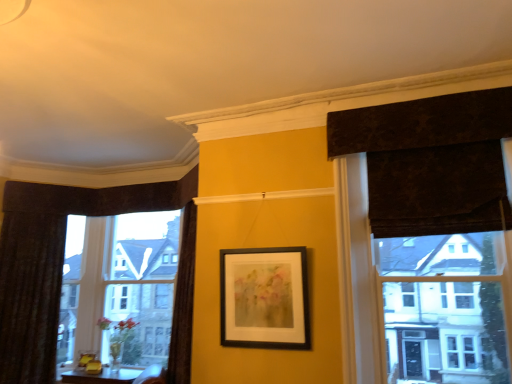
Question: Is velvet dark brown curtain at left, which appears as the first curtain when viewed from the left, shorter than black matte picture frame at center?

Choices:
 (A) yes
 (B) no

Answer: (B)

Question: Considering the relative positions of velvet dark brown curtain at left, positioned as the second curtain in right-to-left order, and black matte picture frame at center in the image provided, is velvet dark brown curtain at left, positioned as the second curtain in right-to-left order, to the left of black matte picture frame at center from the viewer's perspective?

Choices:
 (A) yes
 (B) no

Answer: (A)

Question: Considering the relative positions of velvet dark brown curtain at left, the second curtain viewed from the front, and black matte picture frame at center in the image provided, is velvet dark brown curtain at left, the second curtain viewed from the front, behind black matte picture frame at center?

Choices:
 (A) no
 (B) yes

Answer: (B)

Question: Is velvet dark brown curtain at left, positioned as the second curtain in right-to-left order, wider than black matte picture frame at center?

Choices:
 (A) yes
 (B) no

Answer: (A)

Question: Does velvet dark brown curtain at left, which is counted as the first curtain, starting from the back, lie in front of black matte picture frame at center?

Choices:
 (A) no
 (B) yes

Answer: (A)

Question: Is velvet dark brown curtain at left, which appears as the first curtain when viewed from the left, facing towards black matte picture frame at center?

Choices:
 (A) yes
 (B) no

Answer: (B)

Question: Is dark textured curtain at upper right, positioned as the 1th curtain in right-to-left order, touching clear glass window at left?

Choices:
 (A) no
 (B) yes

Answer: (A)

Question: From the image's perspective, does dark textured curtain at upper right, positioned as the 1th curtain in right-to-left order, appear lower than clear glass window at left?

Choices:
 (A) no
 (B) yes

Answer: (A)

Question: From the image's perspective, is dark textured curtain at upper right, the second curtain when ordered from left to right, located above clear glass window at left?

Choices:
 (A) no
 (B) yes

Answer: (B)

Question: Is the position of dark textured curtain at upper right, positioned as the 1th curtain in right-to-left order, less distant than that of clear glass window at left?

Choices:
 (A) no
 (B) yes

Answer: (B)

Question: Is the position of dark textured curtain at upper right, the second curtain when ordered from left to right, more distant than that of clear glass window at left?

Choices:
 (A) no
 (B) yes

Answer: (A)

Question: Is dark textured curtain at upper right, positioned as the 1th curtain in right-to-left order, wider than clear glass window at left?

Choices:
 (A) no
 (B) yes

Answer: (B)

Question: From a real-world perspective, is clear glass window at left physically above dark textured curtain at upper right, the second curtain when ordered from left to right?

Choices:
 (A) no
 (B) yes

Answer: (A)